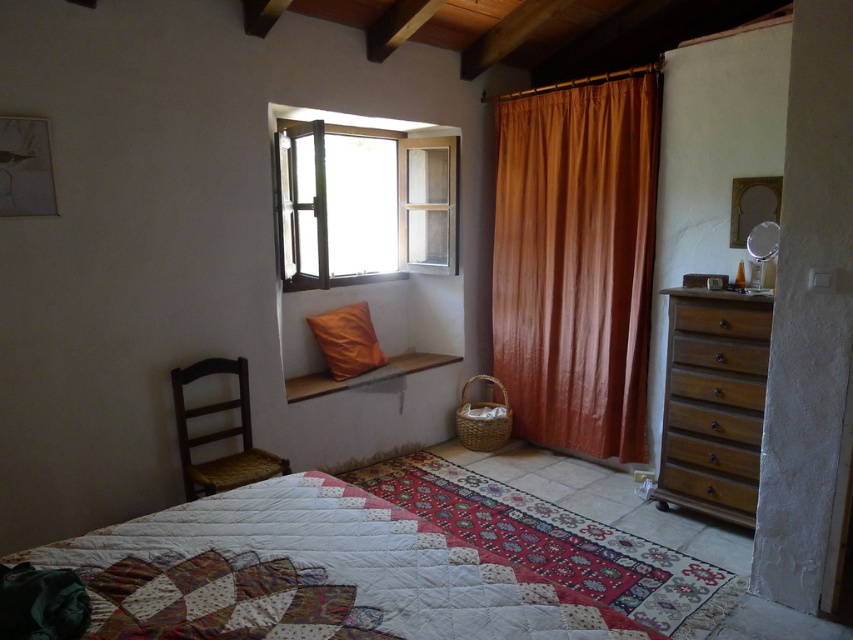
Is wooden window at center taller than brown wooden chair at left?

Yes.

This screenshot has width=853, height=640. What do you see at coordinates (363, 204) in the screenshot?
I see `wooden window at center` at bounding box center [363, 204].

The image size is (853, 640). Find the location of `wooden window at center`. wooden window at center is located at coordinates (363, 204).

Between matte orange curtain at right and brown wooden drawer at right, which one appears on the right side from the viewer's perspective?

Positioned to the right is brown wooden drawer at right.

In the scene shown: Can you confirm if matte orange curtain at right is smaller than brown wooden drawer at right?

No, matte orange curtain at right is not smaller than brown wooden drawer at right.

Describe the element at coordinates (576, 262) in the screenshot. Image resolution: width=853 pixels, height=640 pixels. I see `matte orange curtain at right` at that location.

Where is `matte orange curtain at right`? matte orange curtain at right is located at coordinates (576, 262).

Is brown wooden dresser at right thinner than orange leather pillow at window?

Correct, brown wooden dresser at right's width is less than orange leather pillow at window's.

Who is more distant from viewer, (735, 378) or (375, 342)?

The point (375, 342) is behind.

This screenshot has height=640, width=853. I want to click on brown wooden dresser at right, so click(712, 403).